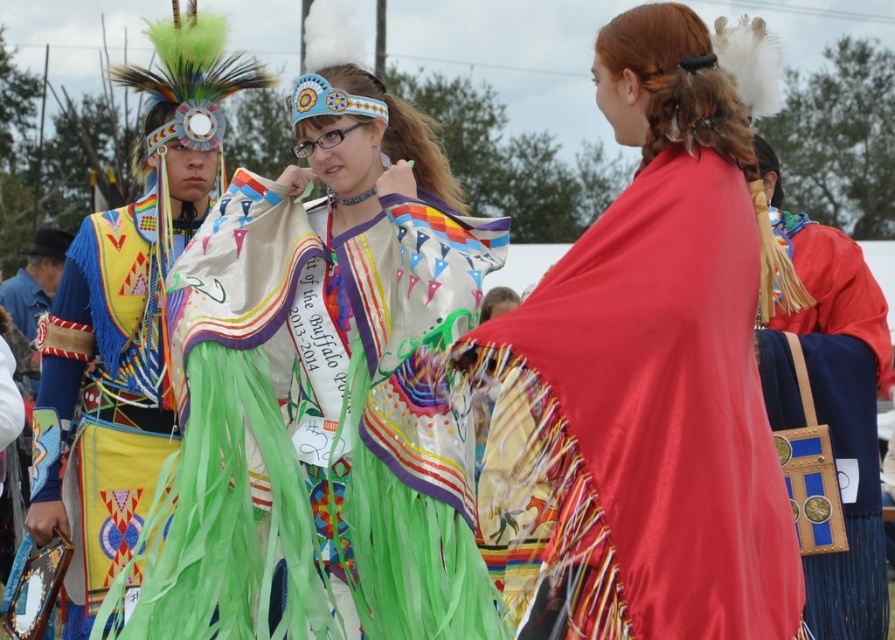
You are attending a cultural event and see a multicolored fabric vest at left and a blue leather bag at right. Which item is positioned higher in the image?

The multicolored fabric vest at left is located above the blue leather bag at right, so it is positioned higher in the image.

You are an attendee at this event and want to take a photo of the shiny red cape at center and the blue leather bag at right. Which object should you focus on first if you want to capture both in the same frame without moving the camera?

The shiny red cape at center is taller than the blue leather bag at right, so you should focus on the shiny red cape at center first to ensure both are in frame.